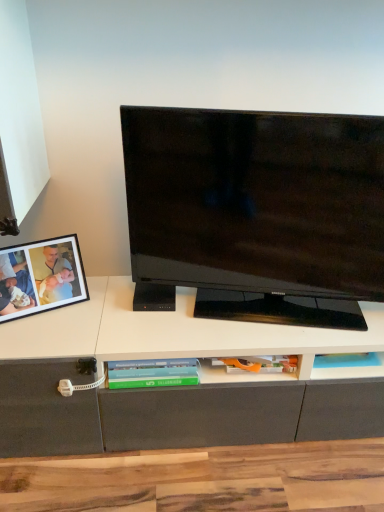
Question: Can you confirm if black glossy television at center is thinner than matte black picture frame at left?

Choices:
 (A) yes
 (B) no

Answer: (B)

Question: From a real-world perspective, is black glossy television at center under matte black picture frame at left?

Choices:
 (A) yes
 (B) no

Answer: (B)

Question: From the image's perspective, is black glossy television at center over matte black picture frame at left?

Choices:
 (A) no
 (B) yes

Answer: (B)

Question: Would you say black glossy television at center is outside matte black picture frame at left?

Choices:
 (A) no
 (B) yes

Answer: (B)

Question: Considering the relative sizes of black glossy television at center and matte black picture frame at left in the image provided, is black glossy television at center smaller than matte black picture frame at left?

Choices:
 (A) no
 (B) yes

Answer: (A)

Question: Is matte black picture frame at left inside or outside of green matte book at center?

Choices:
 (A) outside
 (B) inside

Answer: (A)

Question: In the image, is matte black picture frame at left on the left side or the right side of green matte book at center?

Choices:
 (A) right
 (B) left

Answer: (B)

Question: From a real-world perspective, is matte black picture frame at left above or below green matte book at center?

Choices:
 (A) below
 (B) above

Answer: (B)

Question: Looking at their shapes, would you say matte black picture frame at left is wider or thinner than green matte book at center?

Choices:
 (A) thin
 (B) wide

Answer: (A)

Question: Relative to black glossy television at center, is green matte book at center in front or behind?

Choices:
 (A) behind
 (B) front

Answer: (A)

Question: From their relative heights in the image, would you say green matte book at center is taller or shorter than black glossy television at center?

Choices:
 (A) tall
 (B) short

Answer: (B)

Question: Choose the correct answer: Is green matte book at center inside black glossy television at center or outside it?

Choices:
 (A) inside
 (B) outside

Answer: (B)

Question: Considering the relative positions of green matte book at center and black glossy television at center in the image provided, is green matte book at center to the left or to the right of black glossy television at center?

Choices:
 (A) left
 (B) right

Answer: (A)

Question: Considering their positions, is black glossy television at center located in front of or behind green matte book at center?

Choices:
 (A) behind
 (B) front

Answer: (B)

Question: In the image, is black glossy television at center on the left side or the right side of green matte book at center?

Choices:
 (A) left
 (B) right

Answer: (B)